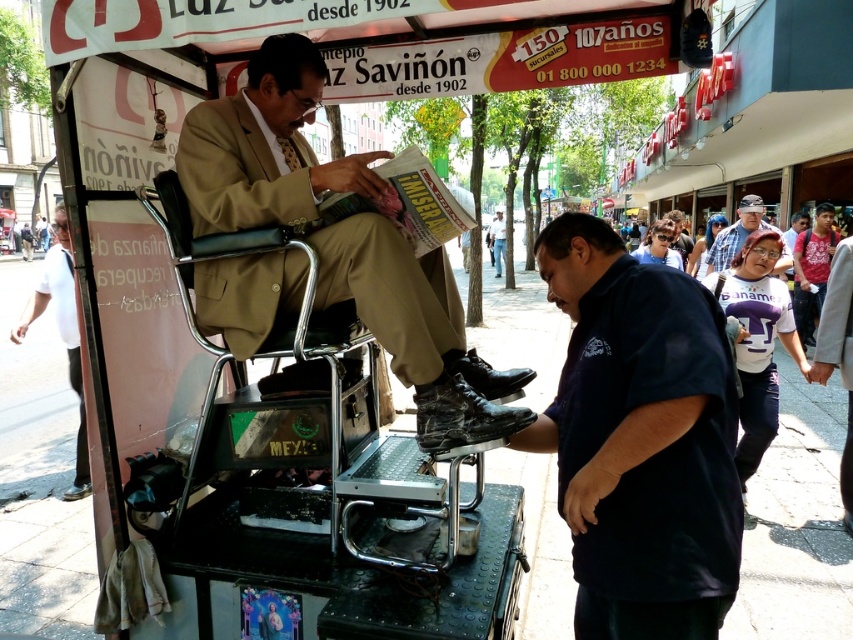
At what (x,y) coordinates should I click in order to perform the action: click on white shirt at left. Please return your answer as a coordinate pair (x, y). Looking at the image, I should click on (61, 332).

Where is `white shirt at left`? Image resolution: width=853 pixels, height=640 pixels. white shirt at left is located at coordinates (61, 332).

Does blue denim shirt at center have a smaller size compared to light brown leather shoes at center?

Indeed, blue denim shirt at center has a smaller size compared to light brown leather shoes at center.

Which is below, blue denim shirt at center or light brown leather shoes at center?

blue denim shirt at center

Is point (787, 259) more distant than point (492, 250)?

No, (787, 259) is closer to viewer.

Find the location of a particular element. blue denim shirt at center is located at coordinates (737, 234).

Is white shirt at left further to camera compared to blue denim shirt at center?

No, white shirt at left is in front of blue denim shirt at center.

Does white shirt at left appear on the left side of blue denim shirt at center?

Yes, white shirt at left is to the left of blue denim shirt at center.

Which is behind, point (70, 353) or point (733, 228)?

Positioned behind is point (733, 228).

Image resolution: width=853 pixels, height=640 pixels. I want to click on white shirt at left, so pos(61,332).